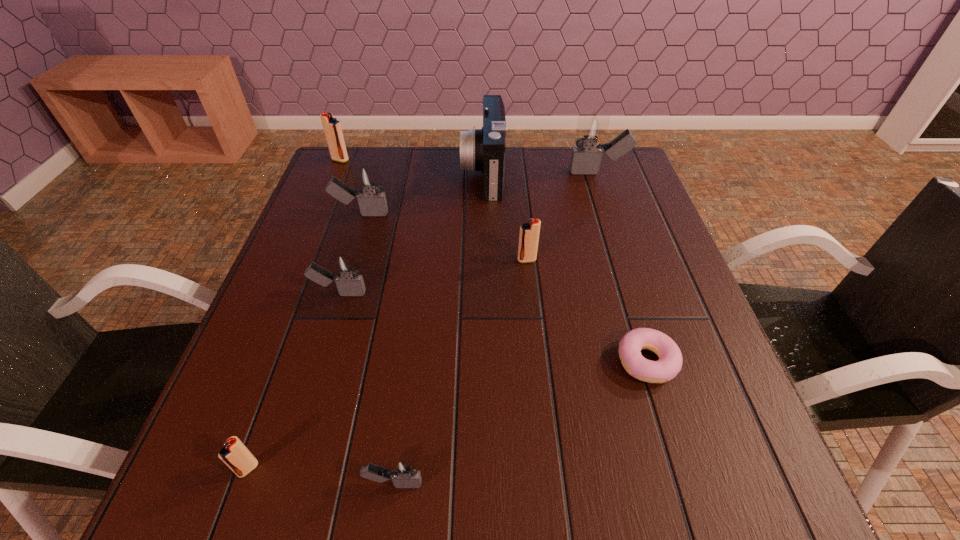
You are a GUI agent. You are given a task and a screenshot of the screen. Output one action in this format:
    pyautogui.click(x=<x>, y=<y>)
    Task: Click on the black camcorder
    The width and height of the screenshot is (960, 540).
    Given the screenshot: What is the action you would take?
    pyautogui.click(x=483, y=149)

At what (x,y) coordinates should I click in order to perform the action: click on camcorder. Please return your answer as a coordinate pair (x, y). This screenshot has width=960, height=540. Looking at the image, I should click on (483, 149).

The width and height of the screenshot is (960, 540). In order to click on the biggest gray igniter in this screenshot , I will do `click(591, 130)`.

This screenshot has width=960, height=540. In order to click on the tallest igniter in this screenshot , I will do `click(591, 130)`.

This screenshot has height=540, width=960. What are the coordinates of `the farthest igniter` in the screenshot? It's located at (332, 128).

Image resolution: width=960 pixels, height=540 pixels. What are the coordinates of `the leftmost igniter` in the screenshot? It's located at (332, 128).

At what (x,y) coordinates should I click in order to perform the action: click on the fifth nearest igniter. Please return your answer as a coordinate pair (x, y). The image size is (960, 540). Looking at the image, I should click on (372, 202).

The height and width of the screenshot is (540, 960). In order to click on the third smallest gray igniter in this screenshot , I will do `click(372, 202)`.

This screenshot has width=960, height=540. Identify the location of the sixth farthest object. (345, 272).

Where is `the third farthest gray igniter`? This screenshot has width=960, height=540. the third farthest gray igniter is located at coordinates (345, 272).